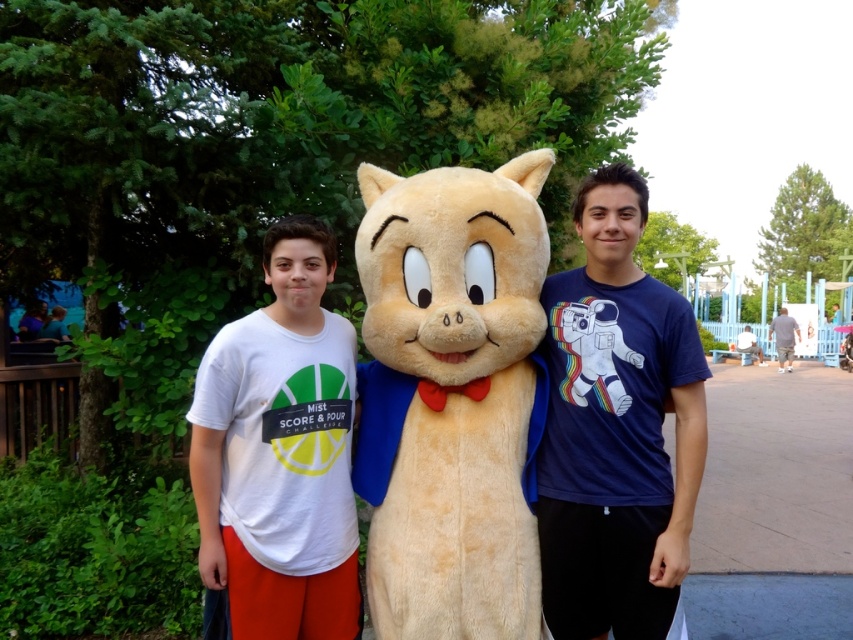
Question: Which point is farther to the camera?

Choices:
 (A) white cotton t-shirt at center
 (B) gray cotton shirt at right
 (C) navy blue t-shirt at center

Answer: (B)

Question: Is fluffy beige plush cat at center below gray cotton shirt at right?

Choices:
 (A) no
 (B) yes

Answer: (A)

Question: Does fluffy beige plush cat at center appear under light blue t-shirt at center?

Choices:
 (A) no
 (B) yes

Answer: (A)

Question: Among these points, which one is farthest from the camera?

Choices:
 (A) (582, 444)
 (B) (756, 355)
 (C) (463, 173)
 (D) (776, 344)

Answer: (B)

Question: Among these points, which one is farthest from the camera?

Choices:
 (A) (665, 285)
 (B) (786, 332)
 (C) (329, 333)
 (D) (527, 285)

Answer: (B)

Question: Can you confirm if gray cotton shirt at right is smaller than light blue t-shirt at center?

Choices:
 (A) yes
 (B) no

Answer: (B)